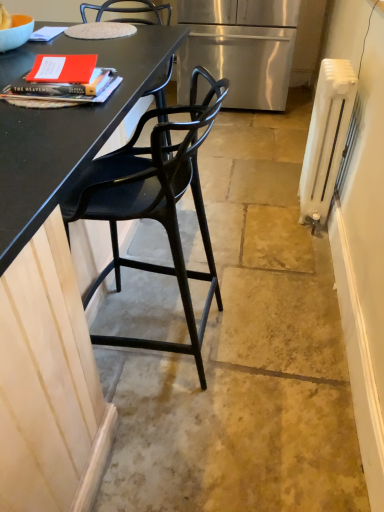
Locate an element on the screen. This screenshot has height=512, width=384. free region under black matte chair at left (from a real-world perspective) is located at coordinates (149, 338).